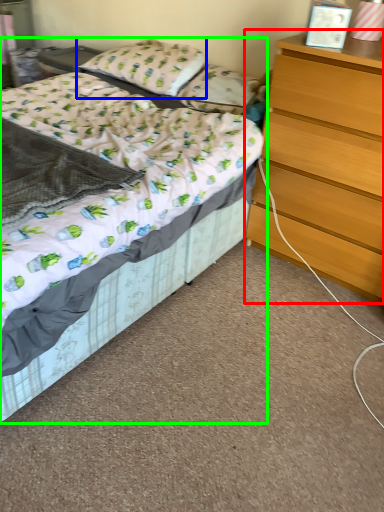
Question: Based on their relative distances, which object is farther from chest of drawers (highlighted by a red box)? Choose from pillow (highlighted by a blue box) and bed (highlighted by a green box).

Choices:
 (A) pillow
 (B) bed

Answer: (A)